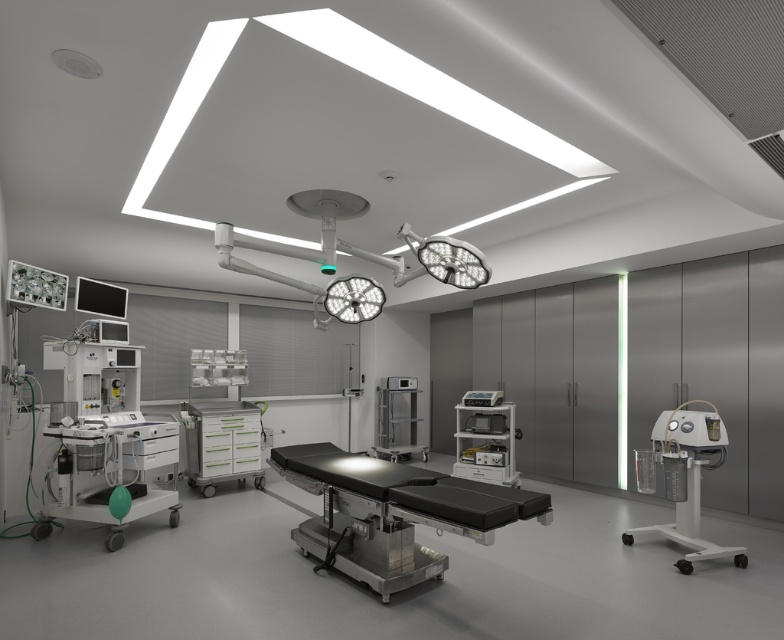
Question: Which object is the farthest from the white plastic oxygen concentrator at right?

Choices:
 (A) white plastic medical cart at center
 (B) white glossy tool chest at center
 (C) satin silver medical cart at center

Answer: (C)

Question: Is white plastic oxygen concentrator at right behind satin silver medical cart at center?

Choices:
 (A) no
 (B) yes

Answer: (A)

Question: Which point is closer to the camera?

Choices:
 (A) white plastic oxygen concentrator at right
 (B) black matte surgical table at center

Answer: (B)

Question: Is white glossy medical cart at lower left behind white glossy tool chest at center?

Choices:
 (A) no
 (B) yes

Answer: (A)

Question: Is white glossy medical cart at lower left above white plastic oxygen concentrator at right?

Choices:
 (A) yes
 (B) no

Answer: (B)

Question: Based on their relative distances, which object is nearer to the black matte surgical table at center?

Choices:
 (A) satin silver medical cart at center
 (B) white glossy tool chest at center

Answer: (B)